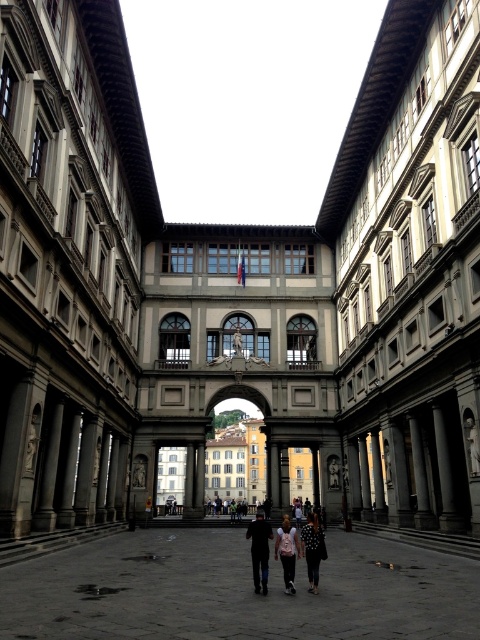
Question: Does dark gray stone courtyard at center have a smaller size compared to pink fabric dress at center?

Choices:
 (A) yes
 (B) no

Answer: (B)

Question: Which is nearer to the dark gray stone courtyard at center?

Choices:
 (A) dark blue jeans at center
 (B) pink fabric dress at center
 (C) black dotted dress at center

Answer: (A)

Question: Can you confirm if black dotted dress at center is positioned to the right of pink fabric dress at center?

Choices:
 (A) no
 (B) yes

Answer: (B)

Question: Does black dotted dress at center have a greater width compared to pink fabric dress at center?

Choices:
 (A) no
 (B) yes

Answer: (B)

Question: Which point is farther to the camera?

Choices:
 (A) dark gray stone courtyard at center
 (B) dark blue jeans at center
 (C) pink fabric dress at center

Answer: (B)

Question: Which of these objects is positioned closest to the dark gray stone courtyard at center?

Choices:
 (A) pink fabric dress at center
 (B) dark blue jeans at center
 (C) black dotted dress at center

Answer: (B)